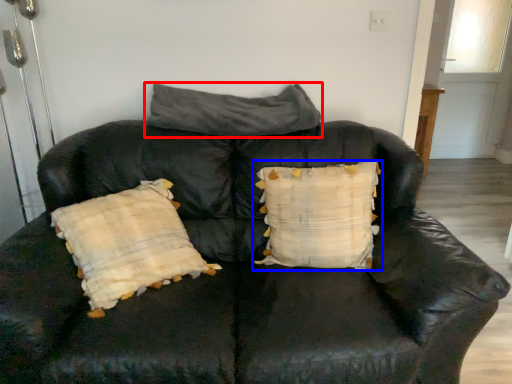
Question: Which point is further to the camera, pillow (highlighted by a red box) or pillow (highlighted by a blue box)?

Choices:
 (A) pillow
 (B) pillow

Answer: (A)